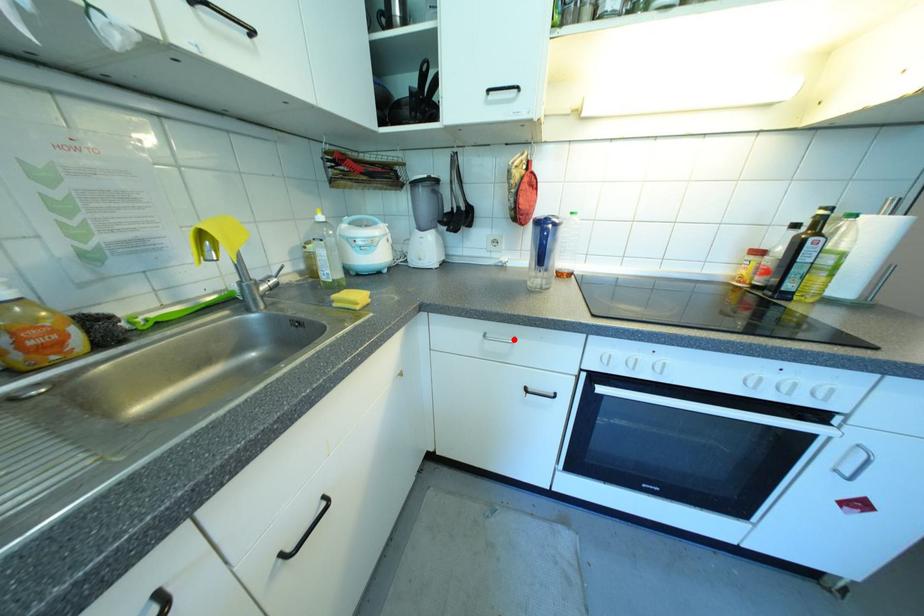
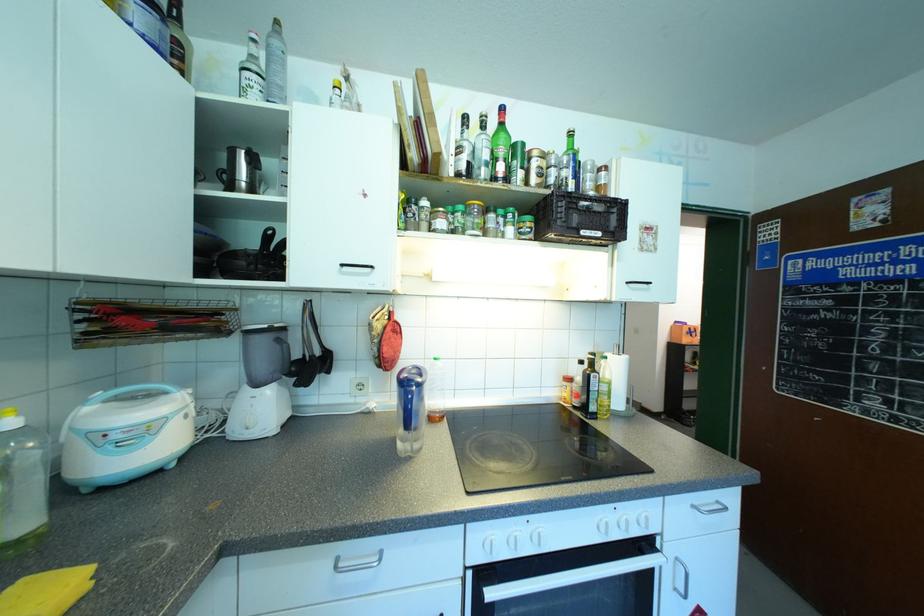
Locate, in the second image, the point that corresponds to the highlighted location in the first image.

(380, 557)